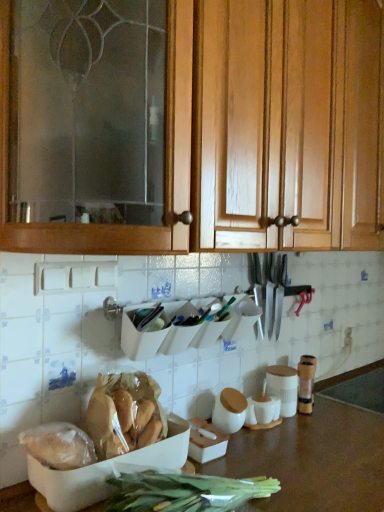
Measure the distance between wooden cabinet at upper center and camera.

wooden cabinet at upper center is 32.52 inches from camera.

The width and height of the screenshot is (384, 512). What do you see at coordinates (59, 446) in the screenshot?
I see `translucent plastic bag of bread at lower left, the first food in the left-to-right sequence` at bounding box center [59, 446].

The width and height of the screenshot is (384, 512). In order to click on translucent plastic bag of bread at lower left, the second food in the left-to-right sequence in this screenshot , I will do `click(125, 414)`.

Locate an element on the screen. brown matte countertop at lower center is located at coordinates (313, 460).

Is translucent plastic bag of bread at lower left, the 1th food in the right-to-left sequence, to the left or to the right of wooden cabinet at upper center in the image?

In the image, translucent plastic bag of bread at lower left, the 1th food in the right-to-left sequence, appears on the left side of wooden cabinet at upper center.

Considering the relative sizes of translucent plastic bag of bread at lower left, the 1th food in the right-to-left sequence, and wooden cabinet at upper center in the image provided, is translucent plastic bag of bread at lower left, the 1th food in the right-to-left sequence, smaller than wooden cabinet at upper center?

Correct, translucent plastic bag of bread at lower left, the 1th food in the right-to-left sequence, occupies less space than wooden cabinet at upper center.

Find the location of a particular element. the 1st food counting from the left of the wooden cabinet at upper center is located at coordinates 125,414.

Is translucent plastic bag of bread at lower left, the 1th food in the right-to-left sequence, wider or thinner than wooden cabinet at upper center?

Considering their sizes, translucent plastic bag of bread at lower left, the 1th food in the right-to-left sequence, looks slimmer than wooden cabinet at upper center.

Is brown matte countertop at lower center at the back of translucent plastic bag of bread at lower left, the 1th food in the right-to-left sequence?

No, brown matte countertop at lower center is not at the back of translucent plastic bag of bread at lower left, the 1th food in the right-to-left sequence.

Is translucent plastic bag of bread at lower left, the 1th food in the right-to-left sequence, with brown matte countertop at lower center?

translucent plastic bag of bread at lower left, the 1th food in the right-to-left sequence, and brown matte countertop at lower center are not in contact.

From a real-world perspective, relative to brown matte countertop at lower center, is translucent plastic bag of bread at lower left, the 1th food in the right-to-left sequence, vertically above or below?

translucent plastic bag of bread at lower left, the 1th food in the right-to-left sequence, is above brown matte countertop at lower center.

Is point (236, 118) closer or farther from the camera than point (232, 443)?

Point (236, 118) appears to be closer to the viewer than point (232, 443).

Between wooden cabinet at upper center and brown matte countertop at lower center, which one appears on the right side from the viewer's perspective?

Positioned to the right is brown matte countertop at lower center.

Between wooden cabinet at upper center and brown matte countertop at lower center, which one has less height?

Standing shorter between the two is brown matte countertop at lower center.

Which of these two, wooden cabinet at upper center or brown matte countertop at lower center, is wider?

brown matte countertop at lower center.

Considering the positions of point (158, 405) and point (62, 426), is point (158, 405) closer or farther from the camera than point (62, 426)?

Point (158, 405) is positioned farther from the camera compared to point (62, 426).

Is translucent plastic bag of bread at lower left, the second food in the left-to-right sequence, aimed at translucent plastic bag of bread at lower left, the first food in the left-to-right sequence?

No.

Identify the location of food that is under the translucent plastic bag of bread at lower left, the second food in the left-to-right sequence (from a real-world perspective). Image resolution: width=384 pixels, height=512 pixels. (59, 446).

Are translucent plastic bag of bread at lower left, the 1th food in the right-to-left sequence, and translucent plastic bag of bread at lower left, the first food in the left-to-right sequence, far apart?

No, translucent plastic bag of bread at lower left, the 1th food in the right-to-left sequence, is not far from translucent plastic bag of bread at lower left, the first food in the left-to-right sequence.

You are a GUI agent. You are given a task and a screenshot of the screen. Output one action in this format:
    pyautogui.click(x=<x>, y=<y>)
    Task: Click on the cutlery directly beneath the wooden cabinet at upper center (from a real-world perspective)
    
    Given the screenshot: What is the action you would take?
    (268, 290)

Does polished silver knife set at center have a greater width compared to wooden cabinet at upper center?

Incorrect, the width of polished silver knife set at center does not surpass that of wooden cabinet at upper center.

Considering the positions of objects polished silver knife set at center and wooden cabinet at upper center in the image provided, who is more to the left, polished silver knife set at center or wooden cabinet at upper center?

polished silver knife set at center.

Is polished silver knife set at center in front of or behind wooden cabinet at upper center in the image?

Visually, polished silver knife set at center is located behind wooden cabinet at upper center.

Based on their sizes in the image, would you say polished silver knife set at center is bigger or smaller than brown matte countertop at lower center?

In the image, polished silver knife set at center appears to be smaller than brown matte countertop at lower center.

What are the coordinates of `cutlery above the brown matte countertop at lower center (from a real-world perspective)` in the screenshot? It's located at (268, 290).

Is wooden cabinet at upper center in contact with polished silver knife set at center?

There is a gap between wooden cabinet at upper center and polished silver knife set at center.

Is wooden cabinet at upper center inside or outside of polished silver knife set at center?

wooden cabinet at upper center is located beyond the bounds of polished silver knife set at center.

Which is closer to the camera, [356,118] or [263,311]?

Point [356,118].

Is wooden cabinet at upper center in front of polished silver knife set at center?

Yes, wooden cabinet at upper center is in front of polished silver knife set at center.

The height and width of the screenshot is (512, 384). Identify the location of the 1st food to the left of the wooden cabinet at upper center, starting your count from the anchor. (125, 414).

Identify the location of countertop directly beneath the translucent plastic bag of bread at lower left, the second food in the left-to-right sequence (from a real-world perspective). (313, 460).

Based on their spatial positions, is brown matte countertop at lower center or translucent plastic bag of bread at lower left, the 2th food from the right, closer to translucent plastic bag of bread at lower left, the second food in the left-to-right sequence?

The object closer to translucent plastic bag of bread at lower left, the second food in the left-to-right sequence, is translucent plastic bag of bread at lower left, the 2th food from the right.

Estimate the real-world distances between objects in this image. Which object is further from brown matte countertop at lower center, wooden cabinet at upper center or translucent plastic bag of bread at lower left, the 2th food from the right?

Among the two, wooden cabinet at upper center is located further to brown matte countertop at lower center.

Looking at the image, which one is located further to wooden cabinet at upper center, translucent plastic bag of bread at lower left, the second food in the left-to-right sequence, or translucent plastic bag of bread at lower left, the 2th food from the right?

Based on the image, translucent plastic bag of bread at lower left, the 2th food from the right, appears to be further to wooden cabinet at upper center.

Estimate the real-world distances between objects in this image. Which object is closer to translucent plastic bag of bread at lower left, the second food in the left-to-right sequence, polished silver knife set at center or translucent plastic bag of bread at lower left, the first food in the left-to-right sequence?

translucent plastic bag of bread at lower left, the first food in the left-to-right sequence, is positioned closer to the anchor translucent plastic bag of bread at lower left, the second food in the left-to-right sequence.

When comparing their distances from translucent plastic bag of bread at lower left, the first food in the left-to-right sequence, does brown matte countertop at lower center or polished silver knife set at center seem closer?

brown matte countertop at lower center lies closer to translucent plastic bag of bread at lower left, the first food in the left-to-right sequence, than the other object.

Looking at the image, which one is located closer to translucent plastic bag of bread at lower left, the 1th food in the right-to-left sequence, polished silver knife set at center or brown matte countertop at lower center?

brown matte countertop at lower center is positioned closer to the anchor translucent plastic bag of bread at lower left, the 1th food in the right-to-left sequence.

Based on the photo, considering their positions, is wooden cabinet at upper center positioned further to brown matte countertop at lower center than polished silver knife set at center?

wooden cabinet at upper center is further to brown matte countertop at lower center.

Which object lies nearer to the anchor point polished silver knife set at center, translucent plastic bag of bread at lower left, the second food in the left-to-right sequence, or brown matte countertop at lower center?

brown matte countertop at lower center lies closer to polished silver knife set at center than the other object.

Locate an element on the screen. Image resolution: width=384 pixels, height=512 pixels. food between translucent plastic bag of bread at lower left, the first food in the left-to-right sequence, and brown matte countertop at lower center from left to right is located at coordinates (125, 414).

The width and height of the screenshot is (384, 512). What are the coordinates of `food positioned between translucent plastic bag of bread at lower left, the first food in the left-to-right sequence, and polished silver knife set at center from near to far` in the screenshot? It's located at (125, 414).

Where is `food between wooden cabinet at upper center and translucent plastic bag of bread at lower left, the 2th food from the right, in the vertical direction`? Image resolution: width=384 pixels, height=512 pixels. food between wooden cabinet at upper center and translucent plastic bag of bread at lower left, the 2th food from the right, in the vertical direction is located at coordinates (125, 414).

I want to click on cutlery between wooden cabinet at upper center and brown matte countertop at lower center from top to bottom, so click(268, 290).